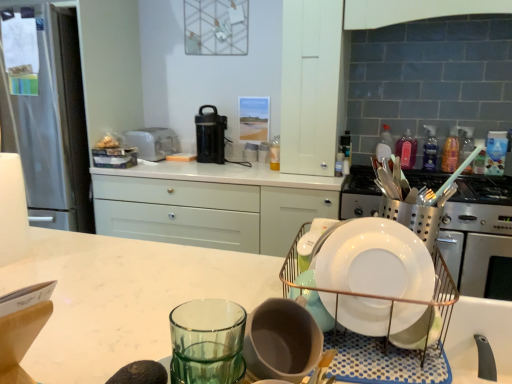
Identify the location of golden brown bread at upper left, the 1th food from the back. Image resolution: width=512 pixels, height=384 pixels. (109, 141).

Locate an element on the screen. The height and width of the screenshot is (384, 512). satin silver gas stove at right is located at coordinates (484, 189).

This screenshot has height=384, width=512. What do you see at coordinates (484, 189) in the screenshot?
I see `satin silver gas stove at right` at bounding box center [484, 189].

How much space does pink plastic bottle at upper right, the first bottle in the right-to-left sequence, occupy horizontally?

pink plastic bottle at upper right, the first bottle in the right-to-left sequence, is 1.93 inches in width.

What is the approximate height of white ceramic sink at lower right?

The height of white ceramic sink at lower right is 21.99 centimeters.

Where is `black plastic coffee maker at center`? Image resolution: width=512 pixels, height=384 pixels. black plastic coffee maker at center is located at coordinates pos(210,136).

Where is `golden brown bread at upper left, which appears as the second food when ordered from the bottom`? golden brown bread at upper left, which appears as the second food when ordered from the bottom is located at coordinates (109, 141).

Who is smaller, pink plastic bottle at upper right, the third bottle viewed from the right, or translucent plastic bottle at upper right, which ranks as the second bottle in left-to-right order?

Smaller between the two is pink plastic bottle at upper right, the third bottle viewed from the right.

In the scene shown: From the image's perspective, which is below, pink plastic bottle at upper right, the third bottle viewed from the right, or translucent plastic bottle at upper right, the fourth bottle from the right?

From the image's view, pink plastic bottle at upper right, the third bottle viewed from the right, is below.

In the scene shown: How distant is pink plastic bottle at upper right, acting as the third bottle starting from the left, from translucent plastic bottle at upper right, the fourth bottle from the right?

pink plastic bottle at upper right, acting as the third bottle starting from the left, is 9.93 centimeters from translucent plastic bottle at upper right, the fourth bottle from the right.

Does point (400, 144) appear closer or farther from the camera than point (386, 147)?

Point (400, 144).

Considering the positions of objects green matte avocado at lower left, positioned as the 2th food in top-to-bottom order, and white ceramic sink at lower right in the image provided, who is in front, green matte avocado at lower left, positioned as the 2th food in top-to-bottom order, or white ceramic sink at lower right?

green matte avocado at lower left, positioned as the 2th food in top-to-bottom order, is closer to the camera.

Between point (147, 379) and point (470, 345), which one is positioned behind?

The point (470, 345) is behind.

Is green matte avocado at lower left, which is counted as the 1th food, starting from the front, in contact with white ceramic sink at lower right?

green matte avocado at lower left, which is counted as the 1th food, starting from the front, is not next to white ceramic sink at lower right, and they're not touching.

Choose the correct answer: Is green matte avocado at lower left, which is the first food in bottom-to-top order, inside white ceramic sink at lower right or outside it?

green matte avocado at lower left, which is the first food in bottom-to-top order, cannot be found inside white ceramic sink at lower right.

From a real-world perspective, between pink plastic bottle at upper right, acting as the third bottle starting from the left, and pink plastic bottle at upper right, the first bottle in the right-to-left sequence, who is vertically higher?

From a 3D spatial view, pink plastic bottle at upper right, the first bottle in the right-to-left sequence, is above.

Are pink plastic bottle at upper right, acting as the third bottle starting from the left, and pink plastic bottle at upper right, the first bottle in the right-to-left sequence, far apart?

pink plastic bottle at upper right, acting as the third bottle starting from the left, is near pink plastic bottle at upper right, the first bottle in the right-to-left sequence, not far away.

Based on the photo, is pink plastic bottle at upper right, the third bottle viewed from the right, thinner than pink plastic bottle at upper right, the first bottle in the right-to-left sequence?

No.

Is pink plastic bottle at upper right, the third bottle viewed from the right, in front of white matte cabinet at upper center?

No, it is not.

Is pink plastic bottle at upper right, acting as the third bottle starting from the left, shorter than white matte cabinet at upper center?

Indeed, pink plastic bottle at upper right, acting as the third bottle starting from the left, has a lesser height compared to white matte cabinet at upper center.

Is pink plastic bottle at upper right, acting as the third bottle starting from the left, situated inside white matte cabinet at upper center or outside?

pink plastic bottle at upper right, acting as the third bottle starting from the left, exists outside the volume of white matte cabinet at upper center.

Which object is positioned more to the left, pink plastic bottle at upper right, the third bottle viewed from the right, or white matte cabinet at upper center?

white matte cabinet at upper center is more to the left.

Based on the photo, considering the sizes of objects white glossy plate at center and black plastic coffee maker at center in the image provided, who is bigger, white glossy plate at center or black plastic coffee maker at center?

Bigger between the two is black plastic coffee maker at center.

Considering the sizes of objects white glossy plate at center and black plastic coffee maker at center in the image provided, who is wider, white glossy plate at center or black plastic coffee maker at center?

black plastic coffee maker at center is wider.

Can you confirm if white glossy plate at center is thinner than pink plastic bottle at upper right, placed as the 5th bottle when sorted from left to right?

In fact, white glossy plate at center might be wider than pink plastic bottle at upper right, placed as the 5th bottle when sorted from left to right.

From the image's perspective, who appears lower, white glossy plate at center or pink plastic bottle at upper right, the first bottle in the right-to-left sequence?

white glossy plate at center.

In the image, there is a pink plastic bottle at upper right, the first bottle in the right-to-left sequence. Identify the location of plate below it (from the image's perspective). (375, 261).

Is the surface of white glossy plate at center in direct contact with pink plastic bottle at upper right, the first bottle in the right-to-left sequence?

No, white glossy plate at center is not with pink plastic bottle at upper right, the first bottle in the right-to-left sequence.

Can you confirm if green matte avocado at lower left, which is counted as the 1th food, starting from the front, is positioned to the left of satin silver toaster at upper center?

No.

Which point is more forward, (147, 363) or (173, 146)?

The point (147, 363) is in front.

Is green matte avocado at lower left, which is counted as the 1th food, starting from the front, outside of satin silver toaster at upper center?

green matte avocado at lower left, which is counted as the 1th food, starting from the front, lies outside satin silver toaster at upper center's area.

Locate an element on the screen. The width and height of the screenshot is (512, 384). bottle that is the 1st one when counting forward from the pink plastic bottle at upper right, acting as the third bottle starting from the left is located at coordinates (384, 144).

This screenshot has width=512, height=384. Find the location of `the 1st food above the white ceramic sink at lower right (from a real-world perspective)`. the 1st food above the white ceramic sink at lower right (from a real-world perspective) is located at coordinates (140, 373).

Based on their spatial positions, is white glossy plate at center or translucent plastic bottle at upper right, the fourth bottle from the right, further from satin silver gas stove at right?

Among the two, white glossy plate at center is located further to satin silver gas stove at right.

Estimate the real-world distances between objects in this image. Which object is further from white glossy plate at center, translucent plastic bottle at upper center, the first bottle from the left, or pink plastic bottle at upper right, the third bottle viewed from the right?

pink plastic bottle at upper right, the third bottle viewed from the right.

Which object lies nearer to the anchor point black plastic coffee maker at center, green matte avocado at lower left, which appears as the second food when viewed from the left, or translucent plastic bottle at upper right, the fourth bottle from the right?

translucent plastic bottle at upper right, the fourth bottle from the right, lies closer to black plastic coffee maker at center than the other object.

From the image, which object appears to be farther from golden brown bread at upper left, the second food viewed from the right, satin silver toaster at upper center or white matte cabinet at upper center?

Among the two, white matte cabinet at upper center is located further to golden brown bread at upper left, the second food viewed from the right.

Based on their spatial positions, is pink plastic bottle at upper right, the first bottle in the right-to-left sequence, or satin silver toaster at upper center further from clear plastic bottle at upper right, which appears as the fourth bottle when viewed from the left?

Based on the image, satin silver toaster at upper center appears to be further to clear plastic bottle at upper right, which appears as the fourth bottle when viewed from the left.

Considering their positions, is green matte avocado at lower left, which appears as the second food when viewed from the left, positioned closer to white glossy plate at center than pink plastic bottle at upper right, the third bottle viewed from the right?

green matte avocado at lower left, which appears as the second food when viewed from the left.

Which object lies nearer to the anchor point translucent plastic bottle at upper right, which ranks as the second bottle in left-to-right order, satin silver gas stove at right or satin silver toaster at upper center?

satin silver gas stove at right lies closer to translucent plastic bottle at upper right, which ranks as the second bottle in left-to-right order, than the other object.

In the scene shown: When comparing their distances from green matte avocado at lower left, positioned as the 2th food in top-to-bottom order, does satin silver gas stove at right or satin silver toaster at upper center seem closer?

Based on the image, satin silver gas stove at right appears to be nearer to green matte avocado at lower left, positioned as the 2th food in top-to-bottom order.

The height and width of the screenshot is (384, 512). What are the coordinates of `gas stove between white glossy plate at center and black plastic coffee maker at center in the front-back direction` in the screenshot? It's located at (484, 189).

The width and height of the screenshot is (512, 384). In order to click on cabinetry positioned between green matte avocado at lower left, which is counted as the 1th food, starting from the front, and translucent plastic bottle at upper right, the fourth bottle from the right, from near to far in this screenshot , I will do `click(311, 85)`.

Find the location of a particular element. gas stove between translucent plastic bottle at upper center, the first bottle from the left, and clear plastic bottle at upper right, which appears as the 2th bottle when viewed from the right is located at coordinates (484, 189).

At what (x,y) coordinates should I click in order to perform the action: click on cabinetry between white glossy plate at center and pink plastic bottle at upper right, placed as the 5th bottle when sorted from left to right, from front to back. Please return your answer as a coordinate pair (x, y). This screenshot has width=512, height=384. Looking at the image, I should click on (311, 85).